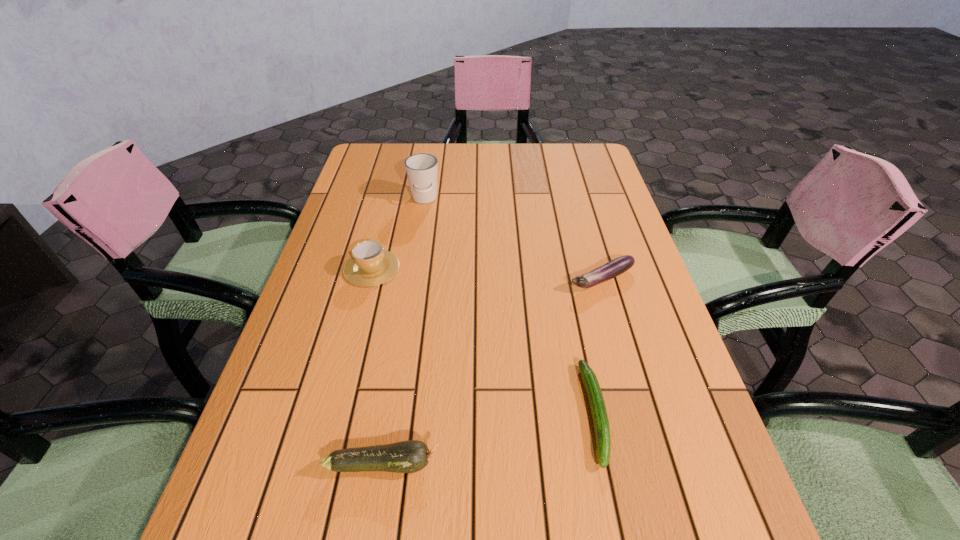
Find the location of a particular element. The height and width of the screenshot is (540, 960). free region located 0.260m with the handle on the side of the shorter cup is located at coordinates (391, 194).

Find the location of a particular element. vacant space located with the handle on the side of the shorter cup is located at coordinates (387, 210).

Where is `vacant space located 0.310m at the blossom end of the left zucchini`? The height and width of the screenshot is (540, 960). vacant space located 0.310m at the blossom end of the left zucchini is located at coordinates (624, 463).

Where is `vacant region located 0.340m on the front of the eggplant`? The height and width of the screenshot is (540, 960). vacant region located 0.340m on the front of the eggplant is located at coordinates (645, 433).

Find the location of `free space located 0.090m on the front-facing side of the shorter zucchini`. free space located 0.090m on the front-facing side of the shorter zucchini is located at coordinates (x=619, y=532).

Identify the location of cup at the left edge. The height and width of the screenshot is (540, 960). (370, 265).

Where is `zucchini that is at the left edge`? Image resolution: width=960 pixels, height=540 pixels. zucchini that is at the left edge is located at coordinates click(410, 456).

Find the location of a particular element. object present at the right edge is located at coordinates (617, 266).

You are a GUI agent. You are given a task and a screenshot of the screen. Output one action in this format:
    pyautogui.click(x=<x>, y=<y>)
    Task: Click on the free space at the far edge
    
    Given the screenshot: What is the action you would take?
    pyautogui.click(x=525, y=169)

Image resolution: width=960 pixels, height=540 pixels. In order to click on vacant space at the left edge of the desktop in this screenshot , I will do `click(284, 421)`.